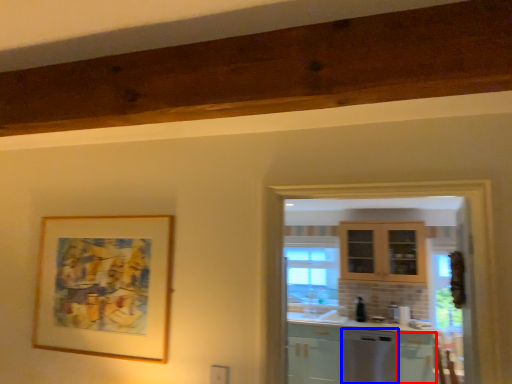
Question: Which of the following is the farthest to the observer, cabinetry (highlighted by a red box) or dish washer (highlighted by a blue box)?

Choices:
 (A) cabinetry
 (B) dish washer

Answer: (B)